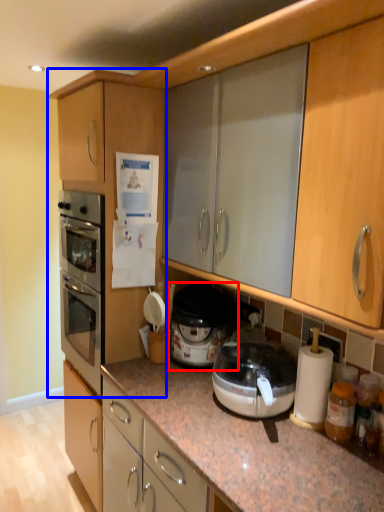
Question: Which of the following is the farthest to the observer, cooker (highlighted by a red box) or cabinetry (highlighted by a blue box)?

Choices:
 (A) cooker
 (B) cabinetry

Answer: (A)